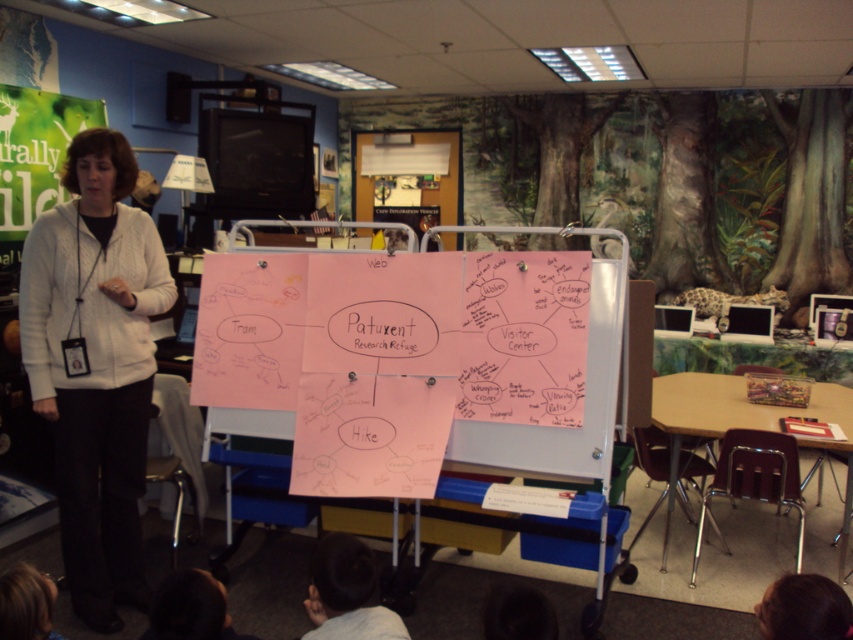
Question: Which point is closer to the camera?

Choices:
 (A) white zip-up sweater at left
 (B) dark hair at lower center
 (C) pink paper at center

Answer: (B)

Question: Which is farther from the dark hair at lower center?

Choices:
 (A) pink paper at center
 (B) white zip-up sweater at left

Answer: (B)

Question: Does white zip-up sweater at left appear on the left side of pink paper at center?

Choices:
 (A) no
 (B) yes

Answer: (B)

Question: From the image, what is the correct spatial relationship of white zip-up sweater at left in relation to dark hair at lower center?

Choices:
 (A) below
 (B) above

Answer: (B)

Question: Which is nearer to the white zip-up sweater at left?

Choices:
 (A) pink paper at center
 (B) dark hair at lower center

Answer: (B)

Question: Where is white zip-up sweater at left located in relation to dark hair at lower center in the image?

Choices:
 (A) right
 (B) left

Answer: (B)